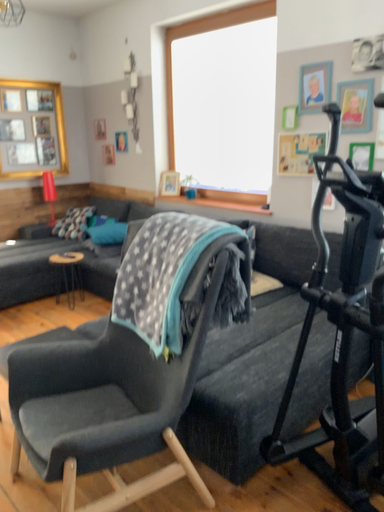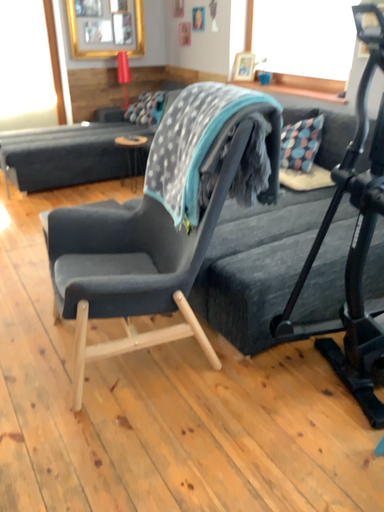
Question: How did the camera likely rotate when shooting the video?

Choices:
 (A) rotated right
 (B) rotated left

Answer: (B)